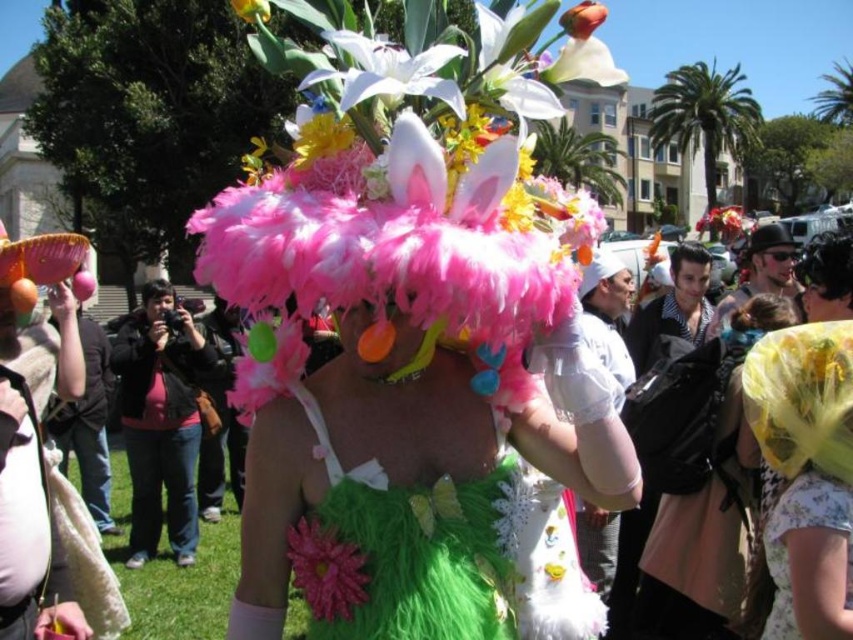
Where is the feathered pink hat at center located in the image?

The feathered pink hat at center is located at point (407, 196) in the image.

You are a photographer trying to capture the feathered pink hat at center and the fluffy pink feathers at upper center in the same frame. Which object should you focus on first to ensure both are in focus?

The feathered pink hat at center is closer to the viewer than the fluffy pink feathers at upper center. To ensure both are in focus, you should focus on the feathered pink hat at center first, as it is closer, and the depth of field may naturally include the farther object.